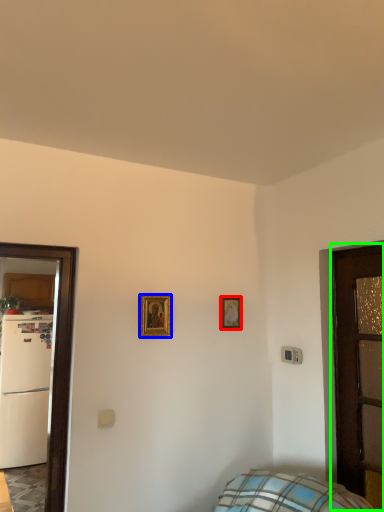
Question: Which is nearer to the picture frame (highlighted by a red box)? picture frame (highlighted by a blue box) or door (highlighted by a green box).

Choices:
 (A) picture frame
 (B) door

Answer: (A)